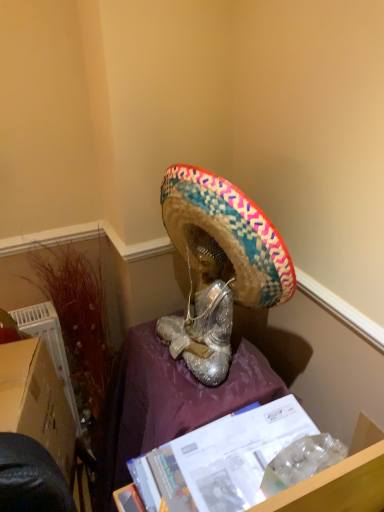
Describe the element at coordinates (232, 461) in the screenshot. The image size is (384, 512). I see `white glossy magazine at lower center` at that location.

Measure the distance between white glossy magazine at lower center and camera.

The distance of white glossy magazine at lower center from camera is 25.98 inches.

I want to click on white glossy magazine at lower center, so click(x=232, y=461).

What are the coordinates of `white glossy magazine at lower center` in the screenshot? It's located at (232, 461).